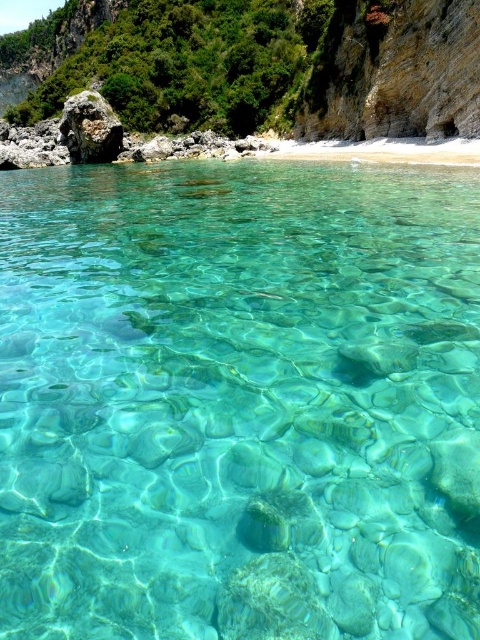
Is rustic stone cliff at upper center to the right of rough textured rock at left from the viewer's perspective?

In fact, rustic stone cliff at upper center is to the left of rough textured rock at left.

Between point (467, 19) and point (73, 132), which one is positioned in front?

Point (467, 19)

Does point (448, 19) come closer to viewer compared to point (85, 116)?

Yes, it is in front of point (85, 116).

Where is `rustic stone cliff at upper center`? This screenshot has height=640, width=480. rustic stone cliff at upper center is located at coordinates (257, 65).